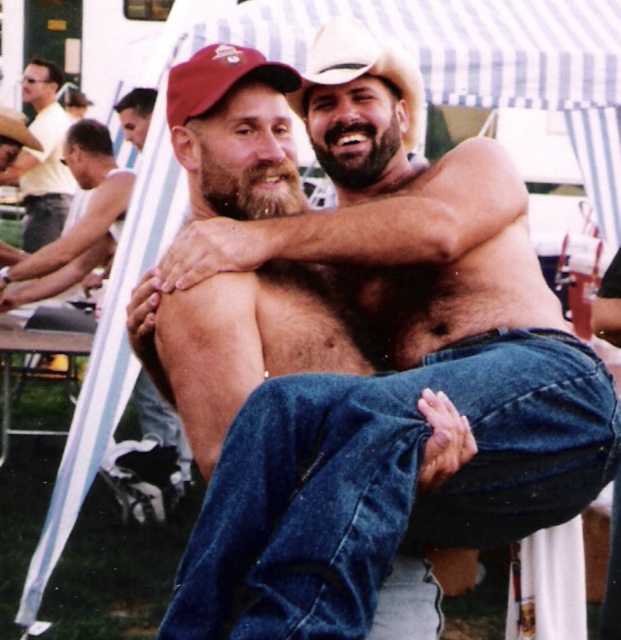
Question: Does denim jeans at center have a larger size compared to matte yellow shirt at upper left?

Choices:
 (A) no
 (B) yes

Answer: (A)

Question: Which object appears farthest from the camera in this image?

Choices:
 (A) denim jeans at center
 (B) matte yellow shirt at upper left
 (C) brown hairy chest at left

Answer: (B)

Question: Which point is farther from the camera taking this photo?

Choices:
 (A) (57, 269)
 (B) (57, 179)
 (C) (296, 400)

Answer: (B)

Question: Is denim jeans at center smaller than brown hairy chest at left?

Choices:
 (A) yes
 (B) no

Answer: (A)

Question: Is the position of denim jeans at center more distant than that of brown hairy chest at left?

Choices:
 (A) yes
 (B) no

Answer: (B)

Question: Considering the real-world distances, which object is closest to the denim jeans at center?

Choices:
 (A) matte yellow shirt at upper left
 (B) brown hairy chest at left

Answer: (B)